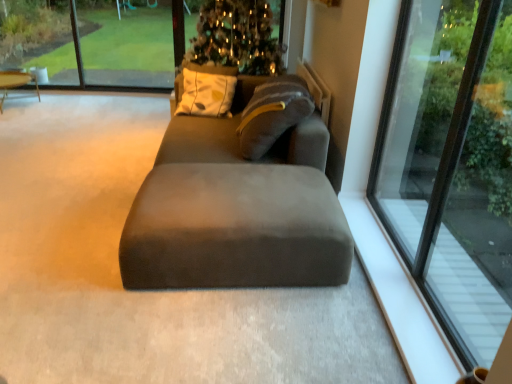
I want to click on free location to the left of suede-like gray studio couch at center, so click(67, 235).